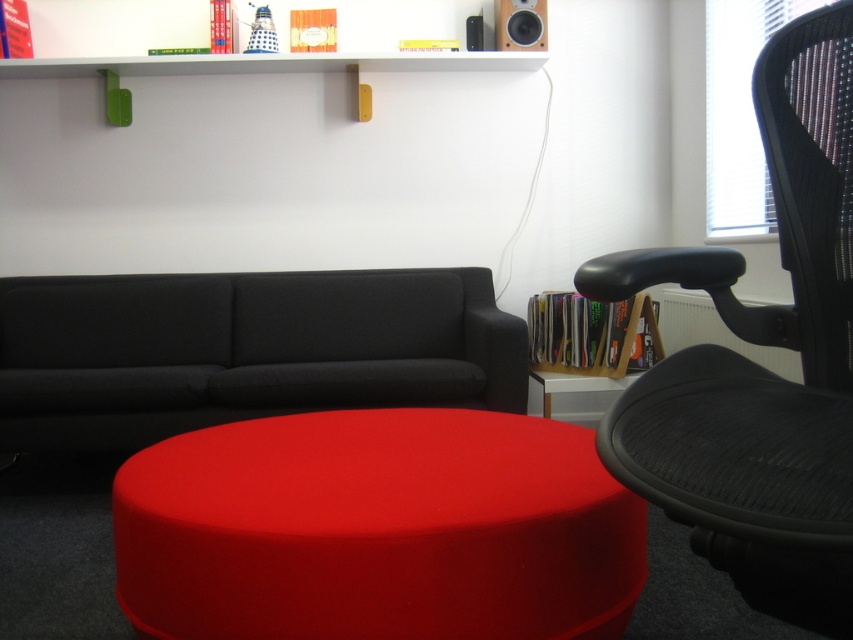
Question: Which object is closer to the camera taking this photo?

Choices:
 (A) white glossy side table at lower center
 (B) matte red ottoman at center
 (C) dark gray fabric couch at center
 (D) matte black speaker at upper center

Answer: (B)

Question: Can you confirm if dark gray fabric couch at center is positioned above white glossy side table at lower center?

Choices:
 (A) yes
 (B) no

Answer: (A)

Question: Which of the following is the farthest from the observer?

Choices:
 (A) matte red ottoman at center
 (B) matte black speaker at upper center

Answer: (B)

Question: In this image, where is black mesh swivel chair at right located relative to dark gray fabric couch at center?

Choices:
 (A) left
 (B) right

Answer: (B)

Question: Is matte red ottoman at center wider than matte black speaker at upper center?

Choices:
 (A) no
 (B) yes

Answer: (B)

Question: Among these objects, which one is nearest to the camera?

Choices:
 (A) black mesh swivel chair at right
 (B) white glossy side table at lower center

Answer: (A)